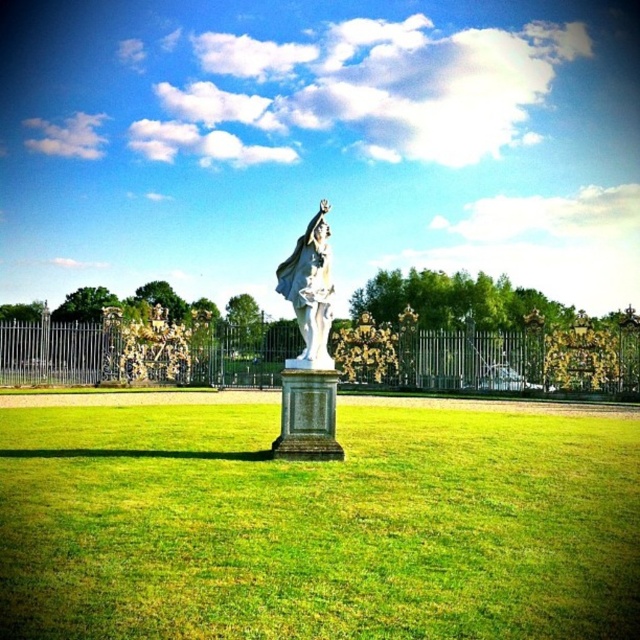
Who is positioned more to the left, green grass at center or white marble statue at center?

Positioned to the left is green grass at center.

The image size is (640, 640). In order to click on green grass at center in this screenshot , I will do point(317,525).